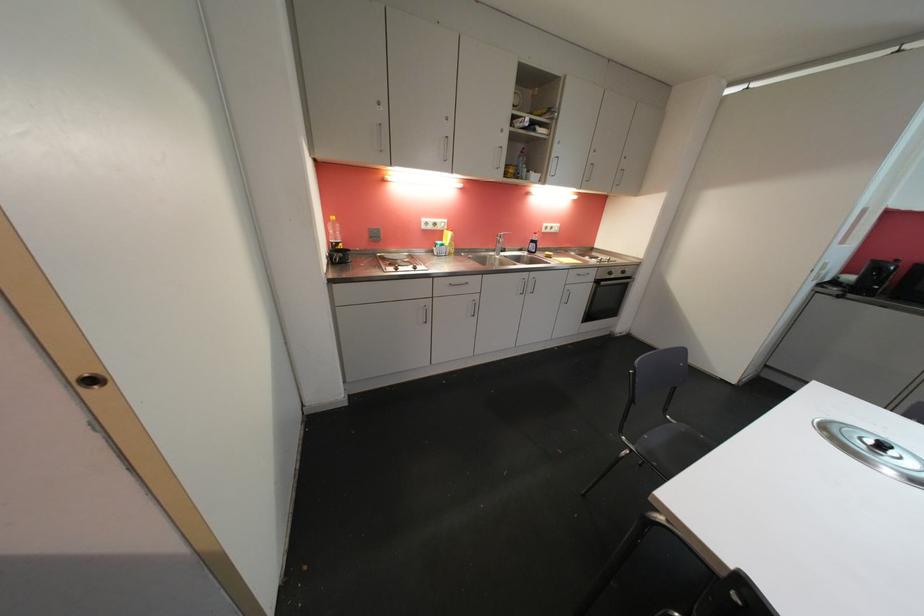
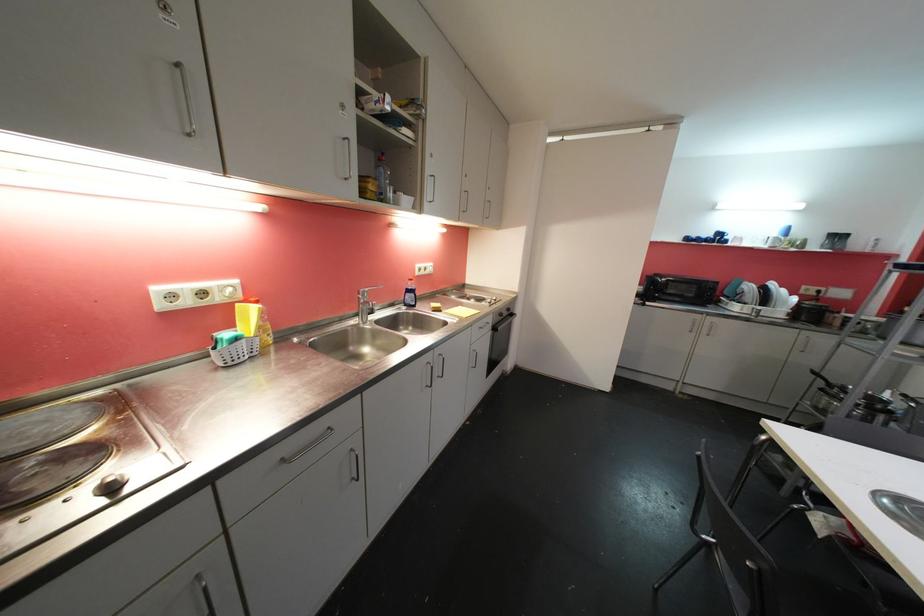
Question: I am providing you with two images of the same scene from different viewpoints. Which of the following objects are not visible in image2?

Choices:
 (A) blue dish soap bottle
 (B) white mug
 (C) yellow soap bottle
 (D) none of these

Answer: (D)